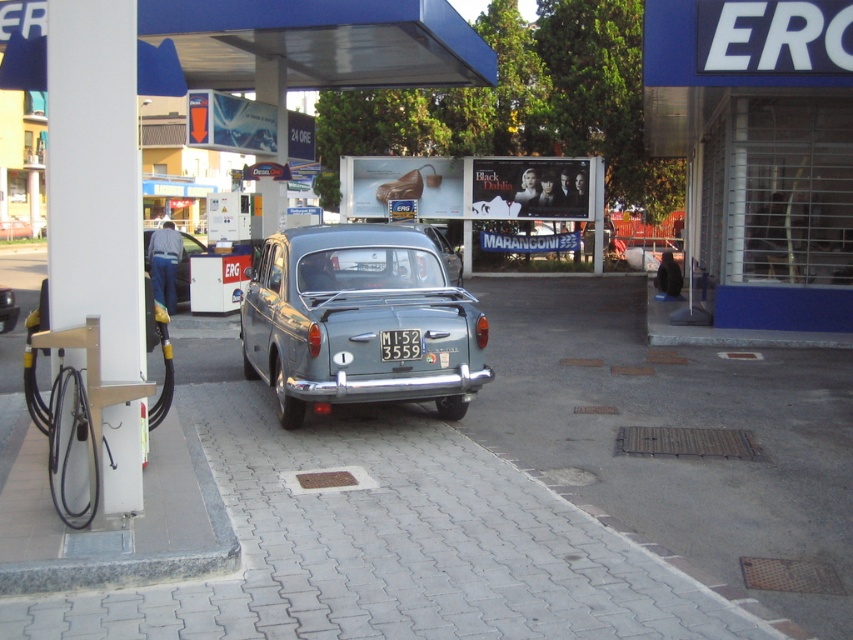
You are standing at the entrance of the gas station and want to take a photo of the matte gray sedan at center. If your camera has a maximum focus range of 40 feet, will you be able to capture the sedan clearly?

The matte gray sedan at center is 40.96 feet away from the camera. Since the camera can only focus up to 40 feet, it won cannot capture the sedan clearly as it is slightly beyond the focus range.